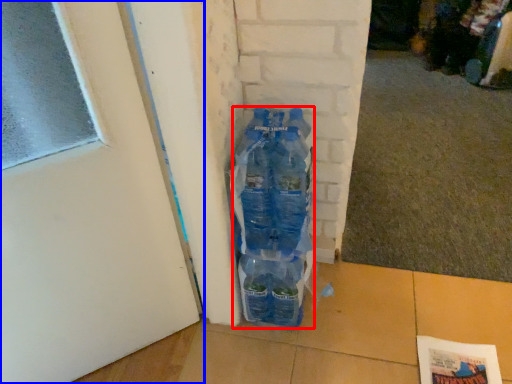
Question: Among these objects, which one is nearest to the camera, bottle (highlighted by a red box) or door (highlighted by a blue box)?

Choices:
 (A) bottle
 (B) door

Answer: (B)